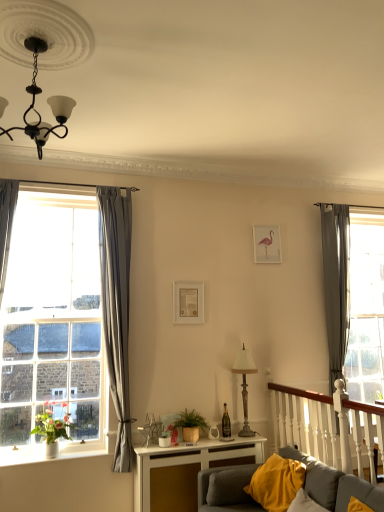
Question: Is the position of matte gold picture frame at center, the first picture frame from the front, less distant than that of yellow fabric pillow at lower right?

Choices:
 (A) no
 (B) yes

Answer: (A)

Question: Does matte gold picture frame at center, which ranks as the second picture frame in top-to-bottom order, lie behind yellow fabric pillow at lower right?

Choices:
 (A) yes
 (B) no

Answer: (A)

Question: Does matte gold picture frame at center, which ranks as the second picture frame in top-to-bottom order, have a lesser height compared to yellow fabric pillow at lower right?

Choices:
 (A) yes
 (B) no

Answer: (A)

Question: Does matte gold picture frame at center, the first picture frame from the front, have a lesser width compared to yellow fabric pillow at lower right?

Choices:
 (A) yes
 (B) no

Answer: (A)

Question: Is matte gold picture frame at center, arranged as the second picture frame when viewed from the back, next to yellow fabric pillow at lower right and touching it?

Choices:
 (A) no
 (B) yes

Answer: (A)

Question: Is yellow fabric pillow at lower right to the left or to the right of gray fabric curtain at right, which is the second curtain in left-to-right order, in the image?

Choices:
 (A) right
 (B) left

Answer: (B)

Question: Based on their sizes in the image, would you say yellow fabric pillow at lower right is bigger or smaller than gray fabric curtain at right, positioned as the 1th curtain in back-to-front order?

Choices:
 (A) small
 (B) big

Answer: (A)

Question: Is point (269, 461) positioned closer to the camera than point (332, 379)?

Choices:
 (A) closer
 (B) farther

Answer: (A)

Question: From a real-world perspective, is yellow fabric pillow at lower right above or below gray fabric curtain at right, positioned as the 1th curtain in right-to-left order?

Choices:
 (A) below
 (B) above

Answer: (A)

Question: Is gray fabric curtain at left, which appears as the 2th curtain when viewed from the right, wider or thinner than matte gold picture frame at center, placed as the first picture frame when sorted from bottom to top?

Choices:
 (A) thin
 (B) wide

Answer: (B)

Question: From the image's perspective, relative to matte gold picture frame at center, positioned as the second picture frame in right-to-left order, is gray fabric curtain at left, which appears as the 2th curtain when viewed from the right, above or below?

Choices:
 (A) above
 (B) below

Answer: (B)

Question: From a real-world perspective, is gray fabric curtain at left, the first curtain viewed from the left, positioned above or below matte gold picture frame at center, arranged as the second picture frame when viewed from the back?

Choices:
 (A) below
 (B) above

Answer: (A)

Question: Relative to matte gold picture frame at center, positioned as the second picture frame in right-to-left order, is gray fabric curtain at left, the first curtain viewed from the left, in front or behind?

Choices:
 (A) behind
 (B) front

Answer: (B)

Question: Is point (243, 349) closer or farther from the camera than point (253, 485)?

Choices:
 (A) farther
 (B) closer

Answer: (A)

Question: Considering their positions, is metallic lampshade at center-right located in front of or behind yellow fabric pillow at lower right?

Choices:
 (A) front
 (B) behind

Answer: (B)